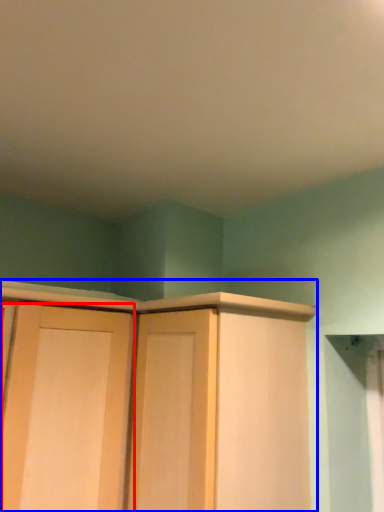
Question: Which object is further to the camera taking this photo, door (highlighted by a red box) or cupboard (highlighted by a blue box)?

Choices:
 (A) door
 (B) cupboard

Answer: (A)